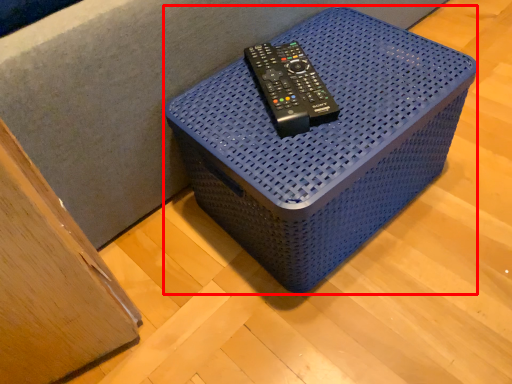
Question: Where is furniture (annotated by the red box) located in relation to equipment in the image?

Choices:
 (A) right
 (B) left

Answer: (A)